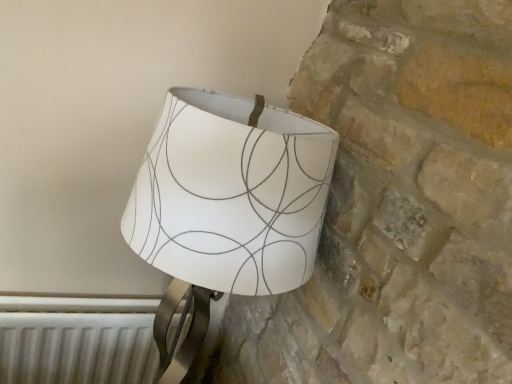
This screenshot has height=384, width=512. Describe the element at coordinates (227, 205) in the screenshot. I see `white paper lampshade at upper right` at that location.

Where is `white paper lampshade at upper right`? The width and height of the screenshot is (512, 384). white paper lampshade at upper right is located at coordinates (227, 205).

Identify the location of white metallic radiator at lower left. This screenshot has width=512, height=384. (77, 348).

Describe the element at coordinates (77, 348) in the screenshot. I see `white metallic radiator at lower left` at that location.

At what (x,y) coordinates should I click in order to perform the action: click on white paper lampshade at upper right. Please return your answer as a coordinate pair (x, y). Looking at the image, I should click on (227, 205).

Which is more to the left, white paper lampshade at upper right or white metallic radiator at lower left?

From the viewer's perspective, white metallic radiator at lower left appears more on the left side.

Which object is closer to the camera taking this photo, white paper lampshade at upper right or white metallic radiator at lower left?

white paper lampshade at upper right is closer to the camera.

Considering the points (173, 110) and (81, 359), which point is in front, point (173, 110) or point (81, 359)?

The point (173, 110) is in front.

From the image's perspective, between white paper lampshade at upper right and white metallic radiator at lower left, who is located below?

white metallic radiator at lower left appears lower in the image.

From a real-world perspective, who is located higher, white paper lampshade at upper right or white metallic radiator at lower left?

In real-world perspective, white paper lampshade at upper right is above.

Considering the sizes of objects white paper lampshade at upper right and white metallic radiator at lower left in the image provided, who is thinner, white paper lampshade at upper right or white metallic radiator at lower left?

With smaller width is white metallic radiator at lower left.

Does white paper lampshade at upper right have a lesser height compared to white metallic radiator at lower left?

No.

Who is bigger, white paper lampshade at upper right or white metallic radiator at lower left?

Bigger between the two is white paper lampshade at upper right.

Would you say white paper lampshade at upper right contains white metallic radiator at lower left?

No.

Is white paper lampshade at upper right placed right next to white metallic radiator at lower left?

white paper lampshade at upper right and white metallic radiator at lower left are clearly separated.

Based on the photo, could you tell me if white paper lampshade at upper right is turned towards white metallic radiator at lower left?

No, white paper lampshade at upper right is not oriented towards white metallic radiator at lower left.

Based on the photo, how many degrees apart are the facing directions of white paper lampshade at upper right and white metallic radiator at lower left?

0.00236 degrees.

Identify the location of radiator below the white paper lampshade at upper right (from the image's perspective). The width and height of the screenshot is (512, 384). (77, 348).

Considering the relative positions of white metallic radiator at lower left and white paper lampshade at upper right in the image provided, is white metallic radiator at lower left to the left or to the right of white paper lampshade at upper right?

From the image, it's evident that white metallic radiator at lower left is to the left of white paper lampshade at upper right.

In the scene shown: Is the position of white metallic radiator at lower left less distant than that of white paper lampshade at upper right?

No.

Which is more distant, (x=123, y=340) or (x=177, y=165)?

The point (x=123, y=340) is farther from the camera.

From the image's perspective, would you say white metallic radiator at lower left is positioned over white paper lampshade at upper right?

Actually, white metallic radiator at lower left appears below white paper lampshade at upper right in the image.

In the scene shown: From a real-world perspective, who is located lower, white metallic radiator at lower left or white paper lampshade at upper right?

From a 3D spatial view, white metallic radiator at lower left is below.

Considering the relative sizes of white metallic radiator at lower left and white paper lampshade at upper right in the image provided, is white metallic radiator at lower left wider than white paper lampshade at upper right?

No, white metallic radiator at lower left is not wider than white paper lampshade at upper right.

Considering the relative sizes of white metallic radiator at lower left and white paper lampshade at upper right in the image provided, is white metallic radiator at lower left shorter than white paper lampshade at upper right?

Yes, white metallic radiator at lower left is shorter than white paper lampshade at upper right.

Is white metallic radiator at lower left bigger than white paper lampshade at upper right?

No, white metallic radiator at lower left is not bigger than white paper lampshade at upper right.

Is white metallic radiator at lower left positioned beyond the bounds of white paper lampshade at upper right?

Yes.

Can you see white metallic radiator at lower left touching white paper lampshade at upper right?

No, white metallic radiator at lower left is not in contact with white paper lampshade at upper right.

From the picture: Is white metallic radiator at lower left positioned with its back to white paper lampshade at upper right?

That's not correct — white metallic radiator at lower left is not looking away from white paper lampshade at upper right.

Can you tell me how much white metallic radiator at lower left and white paper lampshade at upper right differ in facing direction?

0.00236 degrees separate the facing orientations of white metallic radiator at lower left and white paper lampshade at upper right.

Measure the distance from white metallic radiator at lower left to white paper lampshade at upper right.

white metallic radiator at lower left and white paper lampshade at upper right are 25.27 inches apart.

This screenshot has height=384, width=512. Find the location of `lamp above the white metallic radiator at lower left (from a real-world perspective)`. lamp above the white metallic radiator at lower left (from a real-world perspective) is located at coordinates (227, 205).

Find the location of a particular element. radiator behind the white paper lampshade at upper right is located at coordinates (77, 348).

In order to click on lamp above the white metallic radiator at lower left (from the image's perspective) in this screenshot , I will do `click(227, 205)`.